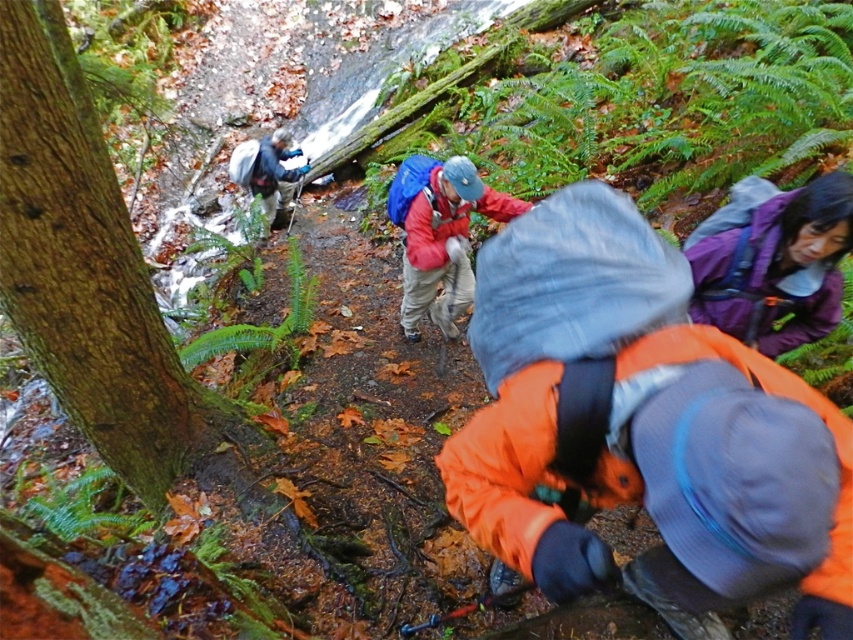
Question: Which of the following is the farthest from the observer?

Choices:
 (A) (656, 611)
 (B) (772, 278)

Answer: (B)

Question: Can you confirm if orange fleece jacket at lower right is wider than matte red jacket at center?

Choices:
 (A) no
 (B) yes

Answer: (B)

Question: Which of the following is the farthest from the observer?

Choices:
 (A) orange fleece jacket at lower right
 (B) purple fleece jacket at upper right
 (C) matte red jacket at center

Answer: (C)

Question: Which object is the farthest from the matte red jacket at center?

Choices:
 (A) orange fleece jacket at lower right
 (B) purple fleece jacket at upper right

Answer: (A)

Question: Can you confirm if purple fleece jacket at upper right is positioned to the right of matte red jacket at center?

Choices:
 (A) yes
 (B) no

Answer: (A)

Question: Does orange fleece jacket at lower right have a greater width compared to purple fleece jacket at upper right?

Choices:
 (A) yes
 (B) no

Answer: (A)